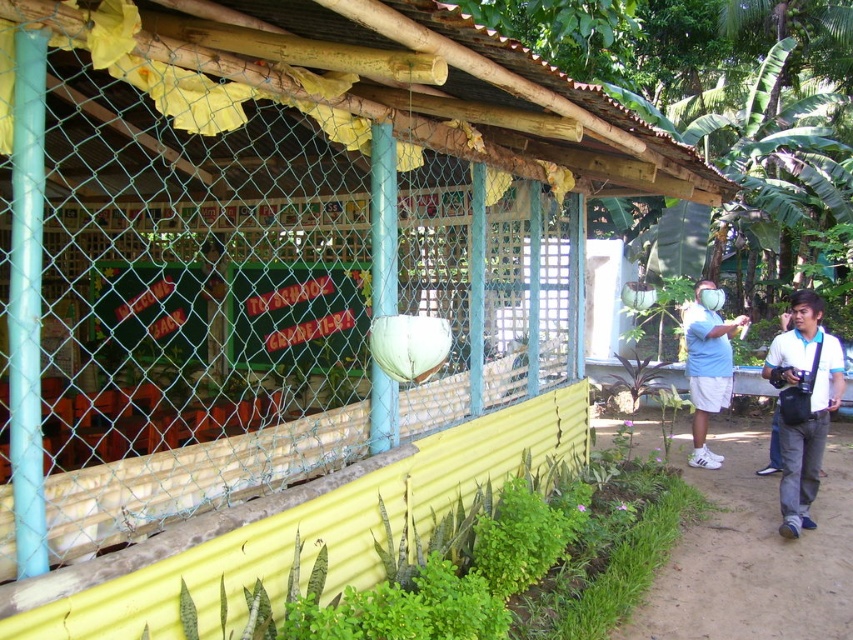
You are standing at the entrance of the kiosk and want to exit towards the brown dirt path at lower right. What direction should you walk to reach it?

The brown dirt path at lower right is located at coordinates point (755, 554), so you should walk towards the lower right direction to reach it.

From the picture: You are standing at the entrance of the rustic outdoor structure and want to walk to the white cotton shirt at right. There is a brown dirt path at lower right. Is the path between you and the shirt, or behind the shirt?

The brown dirt path at lower right and white cotton shirt at right are 36.97 inches apart. Since the path is at lower right and the shirt is at right, the path is behind the shirt from your perspective at the entrance.

You are a delivery person trying to reach the entrance of the kiosk. You see the brown dirt path at lower right and the white matte shirt at right. Which object is closer to the entrance?

The brown dirt path at lower right is located below the white matte shirt at right, so the white matte shirt at right is closer to the entrance.